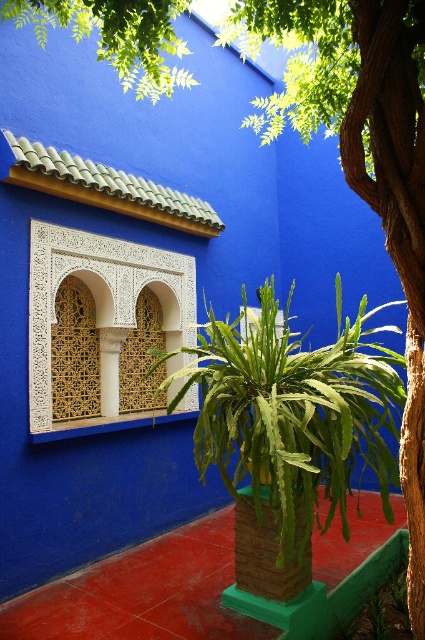
Question: Does brick textured pillar at center have a smaller size compared to white carved wood at center?

Choices:
 (A) no
 (B) yes

Answer: (A)

Question: Is green leafy fern at center to the right of white carved wood at center from the viewer's perspective?

Choices:
 (A) yes
 (B) no

Answer: (A)

Question: Is green leafy fern at center further to camera compared to brick textured pillar at center?

Choices:
 (A) yes
 (B) no

Answer: (B)

Question: Considering the real-world distances, which object is closest to the green leafy fern at center?

Choices:
 (A) brick textured pillar at center
 (B) white carved wood at center

Answer: (A)

Question: Which of the following is the closest to the observer?

Choices:
 (A) green leafy fern at center
 (B) white carved wood at center

Answer: (A)

Question: Which object is positioned closest to the green leafy fern at center?

Choices:
 (A) white carved wood at center
 (B) brick textured pillar at center

Answer: (B)